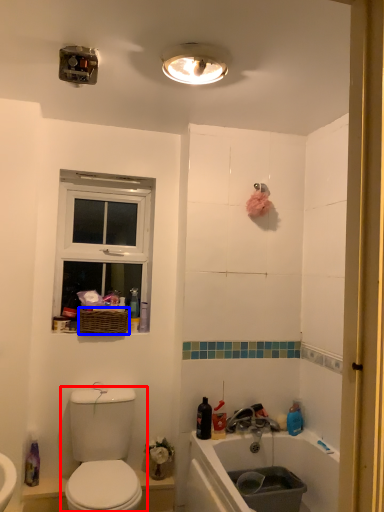
Question: Which point is closer to the camera, toilet (highlighted by a red box) or basket (highlighted by a blue box)?

Choices:
 (A) toilet
 (B) basket

Answer: (A)